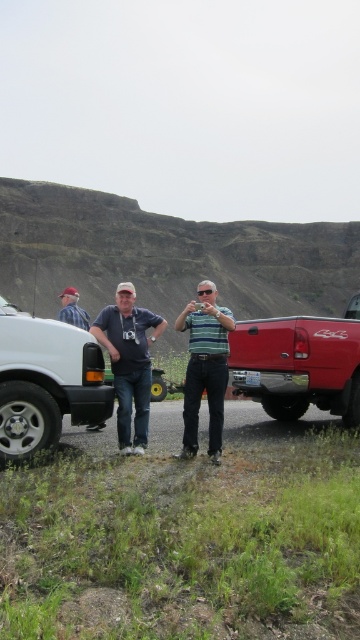
Based on the scene description, can you determine the relative positions of the white matte van at left and the matte blue shirt at center? Which one is positioned more to the left?

The white matte van at left is positioned to the left of the matte blue shirt at center, so the white matte van at left is more to the left.

You are a photographer positioned at the center of the scene. You want to capture a photo that includes both the shiny red truck at right and the striped cotton shirt at center. Based on their positions, which object should you pan your camera towards first to ensure both are in frame?

The shiny red truck at right is to the right of the striped cotton shirt at center. To include both in the frame, you should pan your camera towards the shiny red truck at right first, as it is further to the right and needs to be positioned within the camera view before adjusting to include the striped cotton shirt at center.

You are standing at point (65, 300) and want to walk to point (263, 403). Are you facing the same direction as the man on the right who is holding a camera or phone?

The point (263, 403) is behind point (65, 300), so if you are standing at point (65, 300) and want to walk to point (263, 403), you would be facing away from the man on the right who is holding a camera or phone.